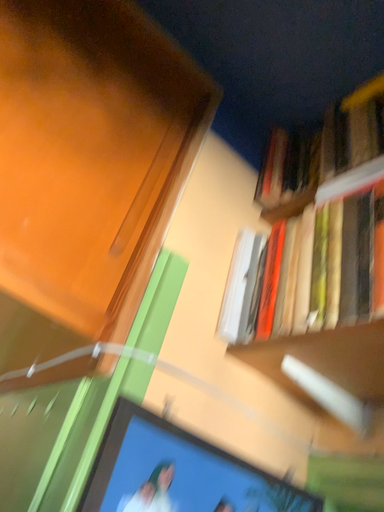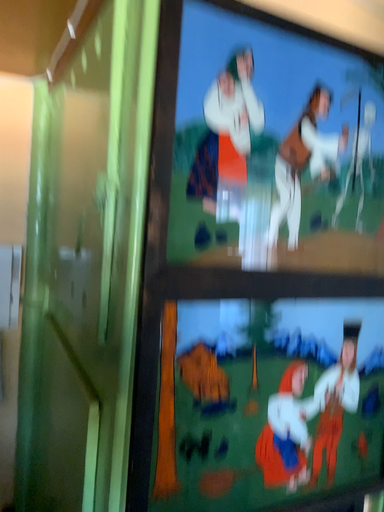
Question: Which way did the camera rotate in the video?

Choices:
 (A) rotated upward
 (B) rotated downward

Answer: (B)